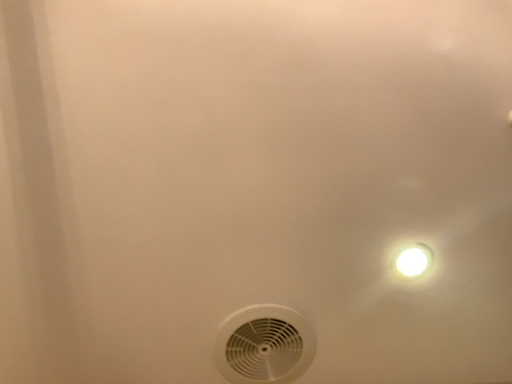
Where is `white glossy light fixture at upper right`? white glossy light fixture at upper right is located at coordinates (413, 261).

What do you see at coordinates (413, 261) in the screenshot?
I see `white glossy light fixture at upper right` at bounding box center [413, 261].

Measure the distance between white glossy light fixture at upper right and camera.

white glossy light fixture at upper right and camera are 29.91 inches apart from each other.

In order to click on white plastic mechanical fan at lower center in this screenshot , I will do `click(264, 345)`.

This screenshot has width=512, height=384. Describe the element at coordinates (264, 345) in the screenshot. I see `white plastic mechanical fan at lower center` at that location.

At what (x,y) coordinates should I click in order to perform the action: click on white glossy light fixture at upper right. Please return your answer as a coordinate pair (x, y). Looking at the image, I should click on (413, 261).

In the image, is white glossy light fixture at upper right on the left side or the right side of white plastic mechanical fan at lower center?

Based on their positions, white glossy light fixture at upper right is located to the right of white plastic mechanical fan at lower center.

Which object is closer to the camera taking this photo, white glossy light fixture at upper right or white plastic mechanical fan at lower center?

white glossy light fixture at upper right is more forward.

Between point (410, 267) and point (229, 334), which one is positioned behind?

Positioned behind is point (229, 334).

From the image's perspective, is white glossy light fixture at upper right above white plastic mechanical fan at lower center?

Yes, from the image's perspective, white glossy light fixture at upper right is over white plastic mechanical fan at lower center.

From a real-world perspective, is white glossy light fixture at upper right positioned over white plastic mechanical fan at lower center based on gravity?

Yes.

Which object is wider, white glossy light fixture at upper right or white plastic mechanical fan at lower center?

white plastic mechanical fan at lower center.

Considering the relative sizes of white glossy light fixture at upper right and white plastic mechanical fan at lower center in the image provided, is white glossy light fixture at upper right taller than white plastic mechanical fan at lower center?

Yes.

Who is bigger, white glossy light fixture at upper right or white plastic mechanical fan at lower center?

→ white plastic mechanical fan at lower center.

Is white glossy light fixture at upper right positioned beyond the bounds of white plastic mechanical fan at lower center?

white glossy light fixture at upper right is positioned outside white plastic mechanical fan at lower center.

From the picture: Is white glossy light fixture at upper right far from white plastic mechanical fan at lower center?

Actually, white glossy light fixture at upper right and white plastic mechanical fan at lower center are a little close together.

Is white glossy light fixture at upper right positioned with its back to white plastic mechanical fan at lower center?

No, white plastic mechanical fan at lower center is not at the back of white glossy light fixture at upper right.

Can you tell me how much white glossy light fixture at upper right and white plastic mechanical fan at lower center differ in facing direction?

They differ by 7.54e-05 degrees in their facing directions.

Image resolution: width=512 pixels, height=384 pixels. What are the coordinates of `light fixture located on the right of white plastic mechanical fan at lower center` in the screenshot? It's located at (413, 261).

Between white plastic mechanical fan at lower center and white glossy light fixture at upper right, which one appears on the right side from the viewer's perspective?

From the viewer's perspective, white glossy light fixture at upper right appears more on the right side.

Which is in front, white plastic mechanical fan at lower center or white glossy light fixture at upper right?

white glossy light fixture at upper right is closer to the camera.

Does point (234, 312) appear closer or farther from the camera than point (396, 268)?

Point (234, 312) is positioned farther from the camera compared to point (396, 268).

Consider the image. From the image's perspective, who appears lower, white plastic mechanical fan at lower center or white glossy light fixture at upper right?

white plastic mechanical fan at lower center, from the image's perspective.

From a real-world perspective, which object rests below the other?

From a 3D spatial view, white plastic mechanical fan at lower center is below.

Which object is wider, white plastic mechanical fan at lower center or white glossy light fixture at upper right?

white plastic mechanical fan at lower center is wider.

Can you confirm if white plastic mechanical fan at lower center is taller than white glossy light fixture at upper right?

No.

Considering the relative sizes of white plastic mechanical fan at lower center and white glossy light fixture at upper right in the image provided, is white plastic mechanical fan at lower center bigger than white glossy light fixture at upper right?

Correct, white plastic mechanical fan at lower center is larger in size than white glossy light fixture at upper right.

Based on the photo, is white plastic mechanical fan at lower center not within white glossy light fixture at upper right?

white plastic mechanical fan at lower center lies outside white glossy light fixture at upper right's area.

Is white plastic mechanical fan at lower center not near white glossy light fixture at upper right?

white plastic mechanical fan at lower center is near white glossy light fixture at upper right, not far away.

Is white plastic mechanical fan at lower center facing away from white glossy light fixture at upper right?

white plastic mechanical fan at lower center does not have its back to white glossy light fixture at upper right.

What's the angular difference between white plastic mechanical fan at lower center and white glossy light fixture at upper right's facing directions?

The facing directions of white plastic mechanical fan at lower center and white glossy light fixture at upper right are 7.54e-05 degrees apart.

Could you measure the distance between white plastic mechanical fan at lower center and white glossy light fixture at upper right?

The distance of white plastic mechanical fan at lower center from white glossy light fixture at upper right is 10.98 inches.

What are the coordinates of `mechanical fan below the white glossy light fixture at upper right (from the image's perspective)` in the screenshot? It's located at (264, 345).

This screenshot has height=384, width=512. Identify the location of mechanical fan below the white glossy light fixture at upper right (from a real-world perspective). (264, 345).

Locate an element on the screen. light fixture located above the white plastic mechanical fan at lower center (from a real-world perspective) is located at coordinates (413, 261).